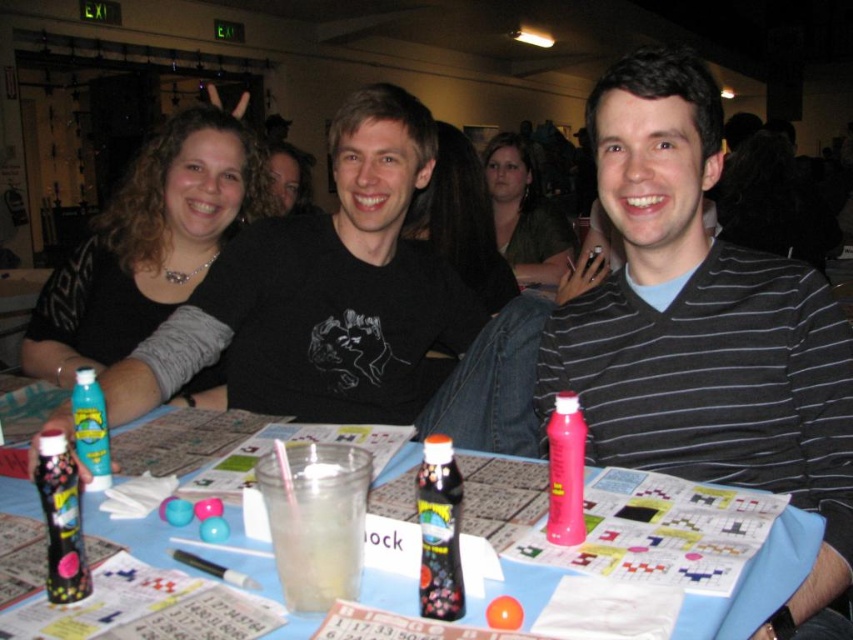
What do you see at coordinates (755, 582) in the screenshot?
I see `blue plastic bottle at center` at bounding box center [755, 582].

Is point (795, 515) less distant than point (363, 476)?

No, it is behind (363, 476).

The height and width of the screenshot is (640, 853). What are the coordinates of `blue plastic bottle at center` in the screenshot? It's located at (755, 582).

Between striped cotton shirt at center and blue plastic bottle at center, which one appears on the right side from the viewer's perspective?

striped cotton shirt at center

Identify the location of striped cotton shirt at center. (704, 332).

The height and width of the screenshot is (640, 853). In order to click on striped cotton shirt at center in this screenshot , I will do `click(704, 332)`.

Does clear plastic cup at center have a larger size compared to translucent plastic spray can at table center?

A: Yes.

Between clear plastic cup at center and translucent plastic spray can at table center, which one has more height?

translucent plastic spray can at table center

Consider the image. Who is more forward, (361, 483) or (83, 392)?

Point (361, 483)

The width and height of the screenshot is (853, 640). Identify the location of clear plastic cup at center. (315, 520).